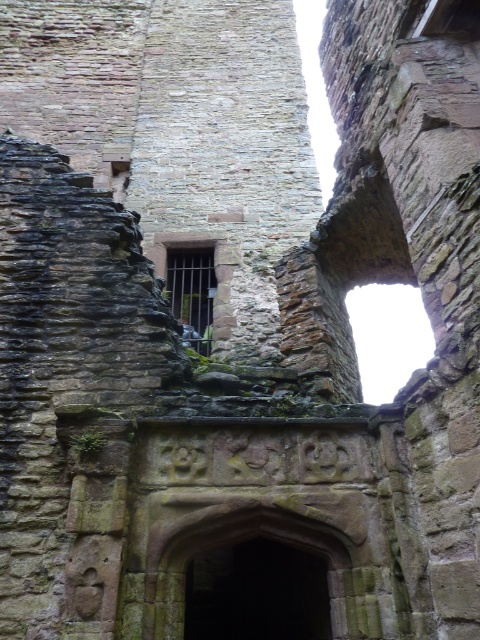
Question: Which point is closer to the camera taking this photo?

Choices:
 (A) (197, 305)
 (B) (259, 577)

Answer: (B)

Question: Which object is farther from the camera taking this photo?

Choices:
 (A) rustic stone archway at center
 (B) dark brown wooden window at center

Answer: (B)

Question: Can you confirm if rustic stone archway at center is bigger than dark brown wooden window at center?

Choices:
 (A) yes
 (B) no

Answer: (A)

Question: Where is rustic stone archway at center located in relation to dark brown wooden window at center in the image?

Choices:
 (A) right
 (B) left

Answer: (A)

Question: Which of the following is the farthest from the observer?

Choices:
 (A) dark brown wooden window at center
 (B) rustic stone archway at center

Answer: (A)

Question: Can you confirm if rustic stone archway at center is positioned to the right of dark brown wooden window at center?

Choices:
 (A) no
 (B) yes

Answer: (B)